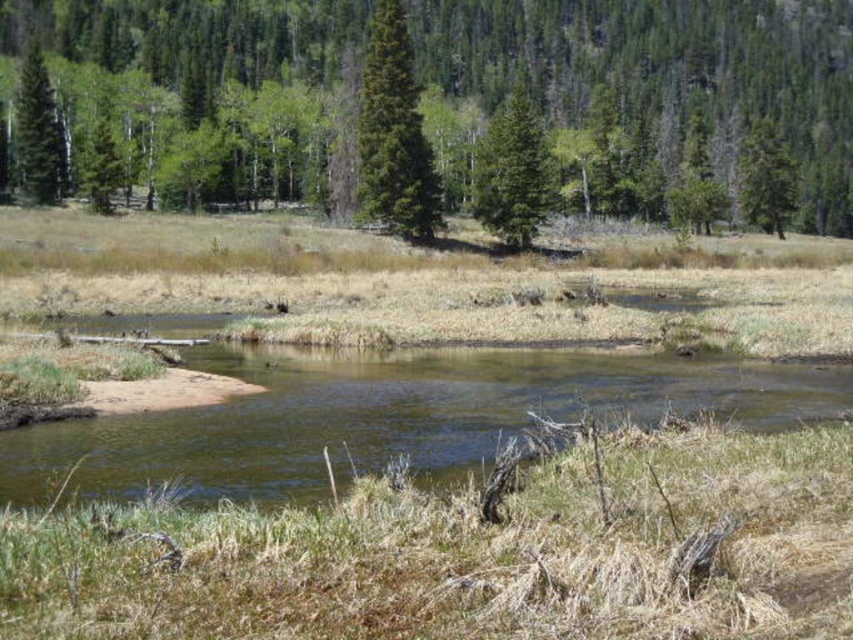
Question: Is green matte evergreen tree at center below green matte tree at left?

Choices:
 (A) yes
 (B) no

Answer: (B)

Question: Does green matte evergreen tree at center have a larger size compared to green matte tree at center?

Choices:
 (A) yes
 (B) no

Answer: (B)

Question: Considering the real-world distances, which object is closest to the green grassy river at center?

Choices:
 (A) green matte tree at center
 (B) green matte evergreen tree at center
 (C) green matte tree at left

Answer: (B)

Question: Does green matte evergreen tree at center appear on the left side of green matte tree at center?

Choices:
 (A) yes
 (B) no

Answer: (A)

Question: Estimate the real-world distances between objects in this image. Which object is closer to the green matte tree at center?

Choices:
 (A) green grassy river at center
 (B) green matte tree at left
 (C) green matte tree at upper center

Answer: (C)

Question: Which point appears closest to the camera in this image?

Choices:
 (A) (590, 93)
 (B) (167, 460)
 (C) (405, 33)
 (D) (521, 218)

Answer: (B)